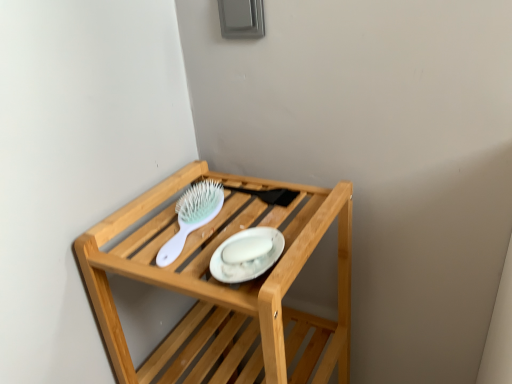
Question: Does point (156, 185) appear closer or farther from the camera than point (187, 188)?

Choices:
 (A) farther
 (B) closer

Answer: (A)

Question: In the image, is wooden shelf at upper center positioned in front of or behind white plastic brush at upper center?

Choices:
 (A) behind
 (B) front

Answer: (B)

Question: Which is farther from the wooden shelf at upper center?

Choices:
 (A) white plastic brush at upper center
 (B) white glossy platter at center

Answer: (B)

Question: Which object is the farthest from the white glossy platter at center?

Choices:
 (A) white plastic brush at upper center
 (B) wooden shelf at upper center

Answer: (B)